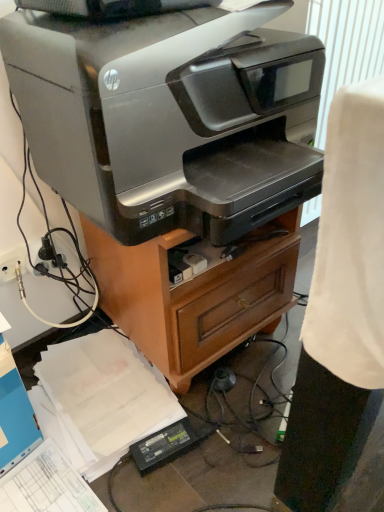
Question: From a real-world perspective, is silver metallic printer at center under black plastic plug at lower left?

Choices:
 (A) no
 (B) yes

Answer: (B)

Question: Are silver metallic printer at center and black plastic plug at lower left far apart?

Choices:
 (A) no
 (B) yes

Answer: (A)

Question: Is silver metallic printer at center bigger than black plastic plug at lower left?

Choices:
 (A) no
 (B) yes

Answer: (B)

Question: Are silver metallic printer at center and black plastic plug at lower left making contact?

Choices:
 (A) no
 (B) yes

Answer: (A)

Question: Does silver metallic printer at center have a greater height compared to black plastic plug at lower left?

Choices:
 (A) no
 (B) yes

Answer: (B)

Question: Is silver metallic printer at center further to camera compared to black plastic plug at lower left?

Choices:
 (A) yes
 (B) no

Answer: (B)

Question: Does satin silver printer at center have a lesser height compared to black plastic plug at lower left?

Choices:
 (A) no
 (B) yes

Answer: (A)

Question: Does satin silver printer at center appear on the right side of black plastic plug at lower left?

Choices:
 (A) yes
 (B) no

Answer: (A)

Question: Can you confirm if satin silver printer at center is positioned to the left of black plastic plug at lower left?

Choices:
 (A) yes
 (B) no

Answer: (B)

Question: Considering the relative sizes of satin silver printer at center and black plastic plug at lower left in the image provided, is satin silver printer at center smaller than black plastic plug at lower left?

Choices:
 (A) yes
 (B) no

Answer: (B)

Question: From a real-world perspective, is satin silver printer at center positioned under black plastic plug at lower left based on gravity?

Choices:
 (A) yes
 (B) no

Answer: (B)

Question: Is satin silver printer at center positioned far away from black plastic plug at lower left?

Choices:
 (A) yes
 (B) no

Answer: (B)

Question: Is black plastic plug at lower left to the left of satin silver printer at center from the viewer's perspective?

Choices:
 (A) yes
 (B) no

Answer: (A)